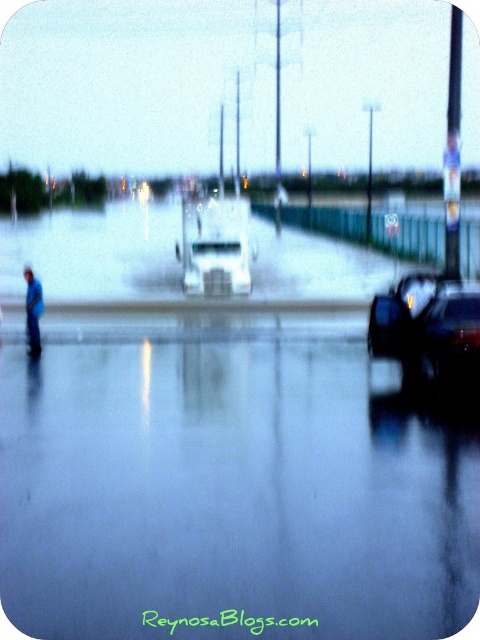
Question: Estimate the real-world distances between objects in this image. Which object is closer to the shiny black car at lower right?

Choices:
 (A) glossy reflective water at lower center
 (B) blue fabric person at left

Answer: (A)

Question: Which of these objects is positioned farthest from the glossy reflective water at lower center?

Choices:
 (A) blue fabric person at left
 (B) shiny black car at lower right

Answer: (A)

Question: Is glossy reflective water at lower center smaller than blue fabric person at left?

Choices:
 (A) yes
 (B) no

Answer: (B)

Question: Which point is closer to the camera taking this photo?

Choices:
 (A) (419, 321)
 (B) (324, 524)

Answer: (B)

Question: Is glossy reflective water at lower center thinner than blue fabric person at left?

Choices:
 (A) no
 (B) yes

Answer: (A)

Question: Is glossy reflective water at lower center bigger than shiny black car at lower right?

Choices:
 (A) no
 (B) yes

Answer: (B)